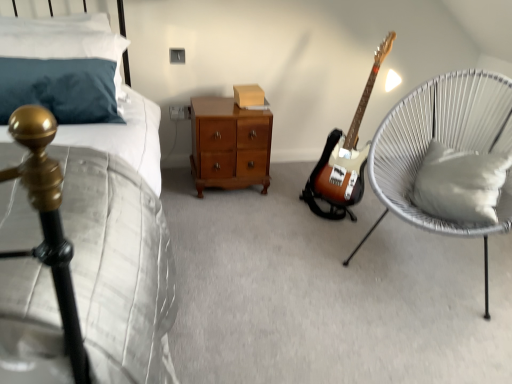
Question: Does white soft cushion at right, the first pillow viewed from the right, touch matte gold headboard at left?

Choices:
 (A) yes
 (B) no

Answer: (B)

Question: Are white soft cushion at right, which is the 1th pillow from bottom to top, and matte gold headboard at left located far from each other?

Choices:
 (A) no
 (B) yes

Answer: (B)

Question: From the image's perspective, is white soft cushion at right, placed as the 2th pillow when sorted from top to bottom, located beneath matte gold headboard at left?

Choices:
 (A) no
 (B) yes

Answer: (A)

Question: From the image's perspective, is white soft cushion at right, the first pillow viewed from the right, on top of matte gold headboard at left?

Choices:
 (A) no
 (B) yes

Answer: (B)

Question: Considering the relative sizes of white soft cushion at right, which is the 2th pillow in left-to-right order, and matte gold headboard at left in the image provided, is white soft cushion at right, which is the 2th pillow in left-to-right order, wider than matte gold headboard at left?

Choices:
 (A) no
 (B) yes

Answer: (A)

Question: Considering the relative sizes of white soft cushion at right, placed as the 2th pillow when sorted from top to bottom, and matte gold headboard at left in the image provided, is white soft cushion at right, placed as the 2th pillow when sorted from top to bottom, thinner than matte gold headboard at left?

Choices:
 (A) no
 (B) yes

Answer: (B)

Question: Considering the relative sizes of matte gold headboard at left and matte cardboard box at center in the image provided, is matte gold headboard at left bigger than matte cardboard box at center?

Choices:
 (A) no
 (B) yes

Answer: (B)

Question: Does matte gold headboard at left have a lesser width compared to matte cardboard box at center?

Choices:
 (A) no
 (B) yes

Answer: (A)

Question: Is matte gold headboard at left not close to matte cardboard box at center?

Choices:
 (A) no
 (B) yes

Answer: (B)

Question: Is matte gold headboard at left smaller than matte cardboard box at center?

Choices:
 (A) no
 (B) yes

Answer: (A)

Question: Is matte gold headboard at left to the left of matte cardboard box at center from the viewer's perspective?

Choices:
 (A) no
 (B) yes

Answer: (B)

Question: Is matte gold headboard at left to the right of matte cardboard box at center from the viewer's perspective?

Choices:
 (A) no
 (B) yes

Answer: (A)

Question: From a real-world perspective, is sunburst wood electric guitar at center on teal fabric pillow at upper left, placed as the first pillow when sorted from left to right?

Choices:
 (A) yes
 (B) no

Answer: (B)